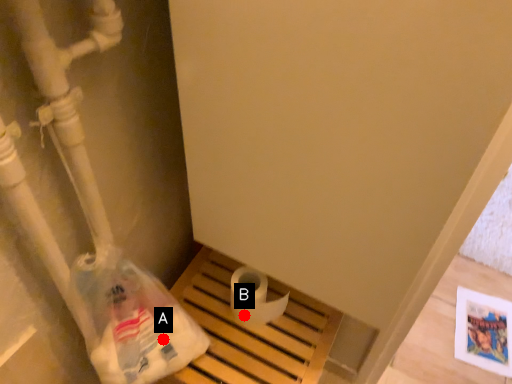
Question: Two points are circled on the image, labeled by A and B beside each circle. Which point is farther to the camera?

Choices:
 (A) A is further
 (B) B is further

Answer: (B)